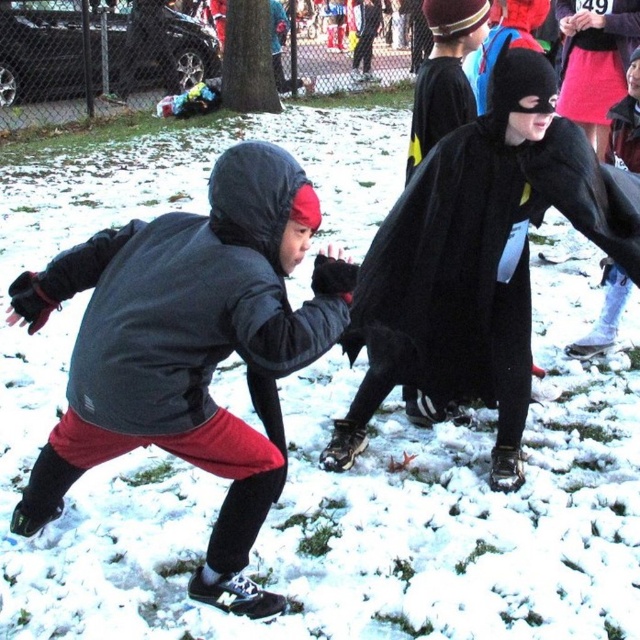
Question: Which point is closer to the camera?

Choices:
 (A) (220, 449)
 (B) (504, 253)

Answer: (A)

Question: Does matte black jacket at left have a smaller size compared to black matte cape at center?

Choices:
 (A) yes
 (B) no

Answer: (B)

Question: Does matte black jacket at left have a greater width compared to black matte cape at center?

Choices:
 (A) no
 (B) yes

Answer: (B)

Question: From the image, what is the correct spatial relationship of matte black jacket at left in relation to black matte cape at center?

Choices:
 (A) right
 (B) left

Answer: (B)